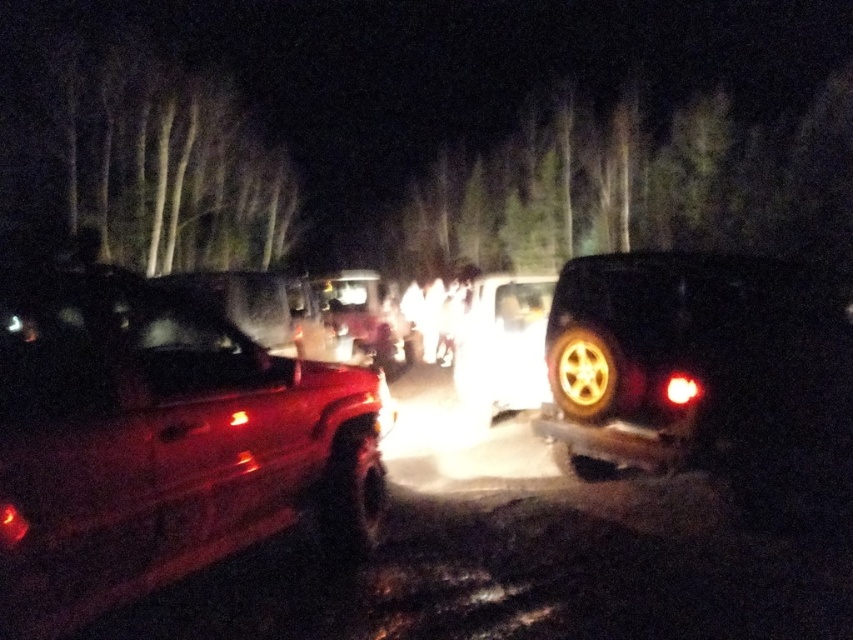
You are a driver trying to navigate through this dark forest path. You see the matte black suv at right and the shiny metallic tire at right. Which object is positioned higher up in your field of view?

The matte black suv at right is located above the shiny metallic tire at right, so it is positioned higher up in your field of view.

You are standing at the origin point in the image. Which direction should you move to reach the matte red truck at left?

You should move towards the left direction to reach the matte red truck at left since it is located at point (x=161, y=444) which is to the left side of the image.